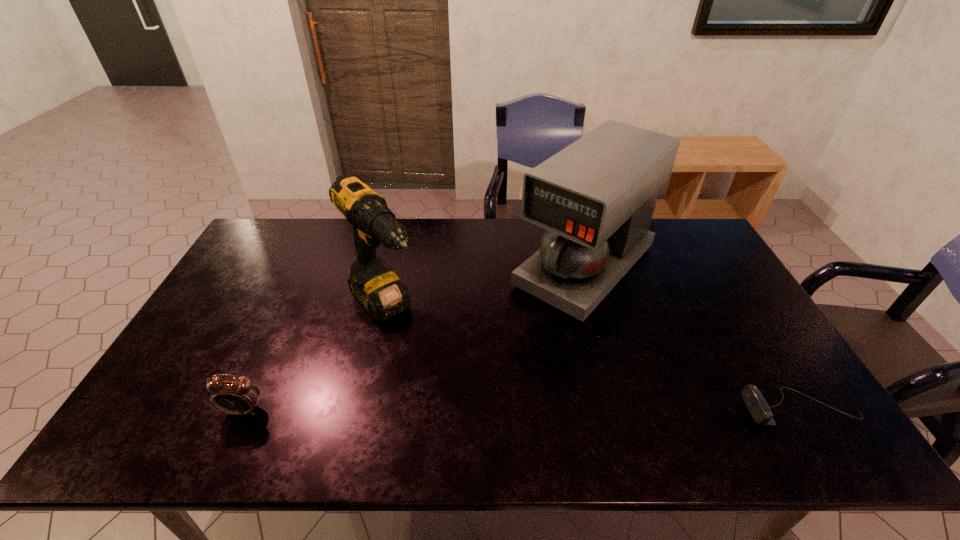
Locate an element on the screen. vacant area that lies between the third tallest object and the webcam is located at coordinates (521, 410).

Locate an element on the screen. Image resolution: width=960 pixels, height=540 pixels. vacant space that is in between the alarm clock and the drill is located at coordinates (315, 359).

Where is `vacant space in between the second object from right to left and the second object from left to right`? The width and height of the screenshot is (960, 540). vacant space in between the second object from right to left and the second object from left to right is located at coordinates (485, 287).

At what (x,y) coordinates should I click in order to perform the action: click on free spot between the drill and the leftmost object. Please return your answer as a coordinate pair (x, y). Looking at the image, I should click on (315, 359).

Locate an element on the screen. The width and height of the screenshot is (960, 540). empty space that is in between the second object from left to right and the alarm clock is located at coordinates pyautogui.click(x=315, y=359).

This screenshot has width=960, height=540. Find the location of `object that ranks as the third closest to the rightmost object`. object that ranks as the third closest to the rightmost object is located at coordinates (234, 395).

Where is `object that is the second closest to the second shortest object`? object that is the second closest to the second shortest object is located at coordinates (596, 197).